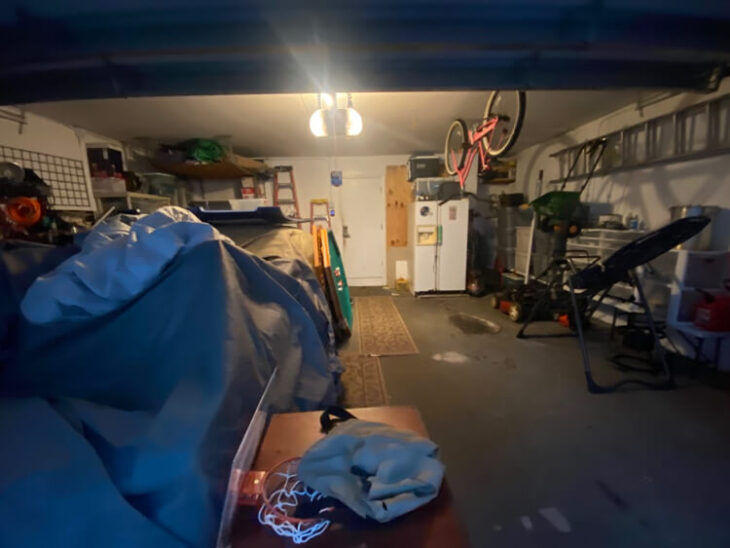
At what (x,y) coordinates should I click in order to perform the action: click on door. Please return your answer as a coordinate pair (x, y). Looking at the image, I should click on (355, 221).